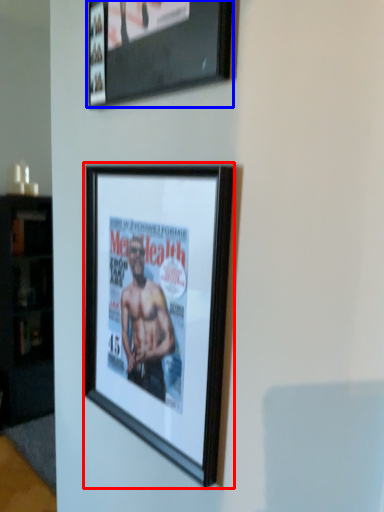
Question: Among these objects, which one is farthest to the camera, picture frame (highlighted by a red box) or picture frame (highlighted by a blue box)?

Choices:
 (A) picture frame
 (B) picture frame

Answer: (A)